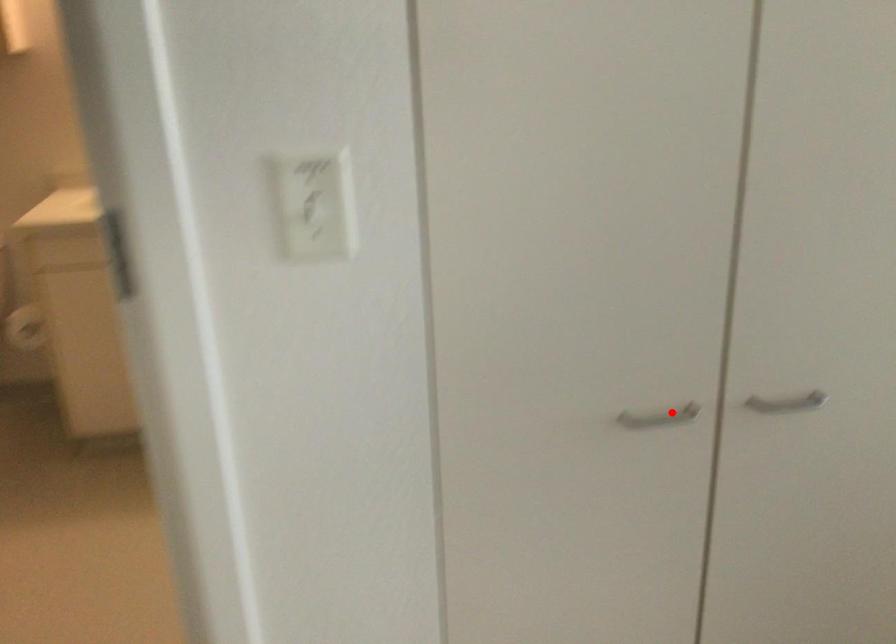
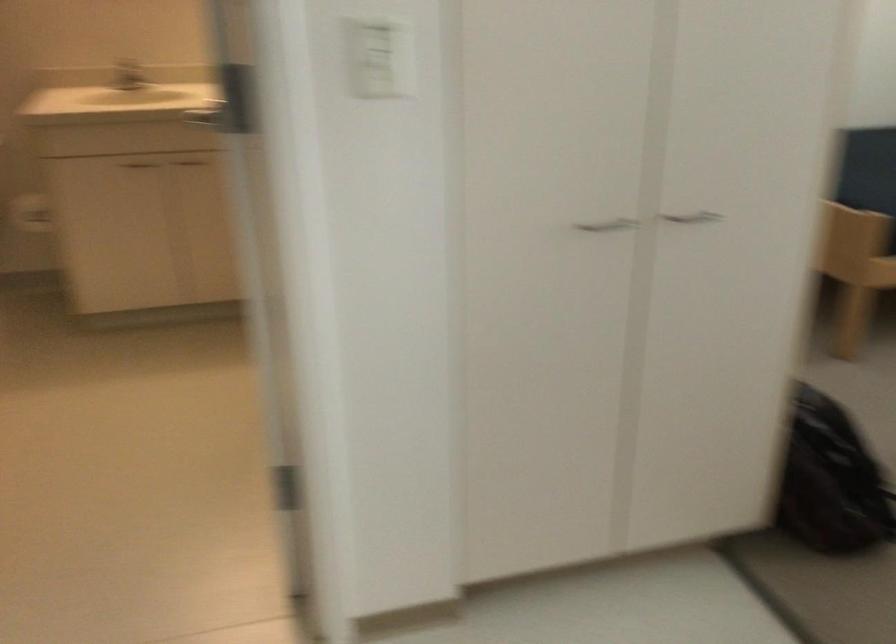
The point at the highlighted location is marked in the first image. Where is the corresponding point in the second image?

(607, 225)